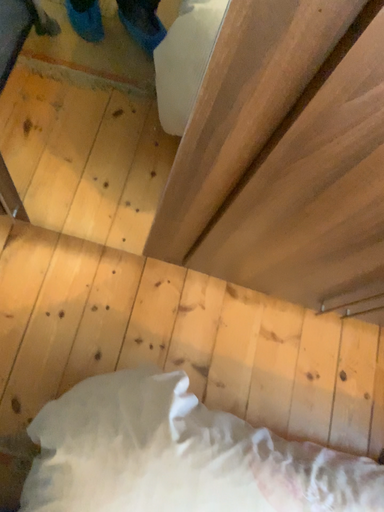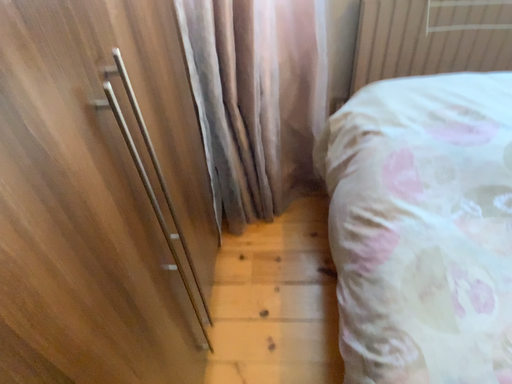
Question: Which way did the camera rotate in the video?

Choices:
 (A) rotated left
 (B) rotated right

Answer: (B)